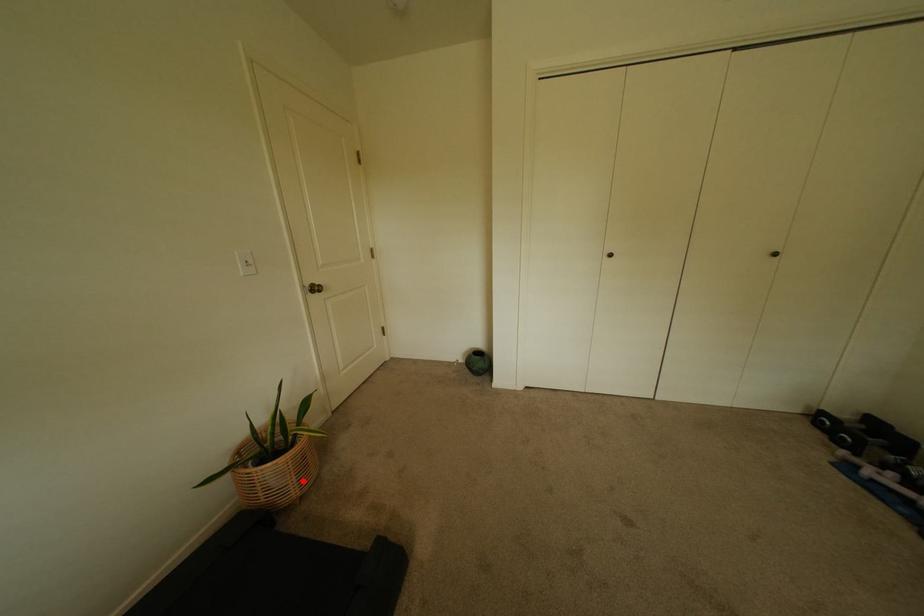
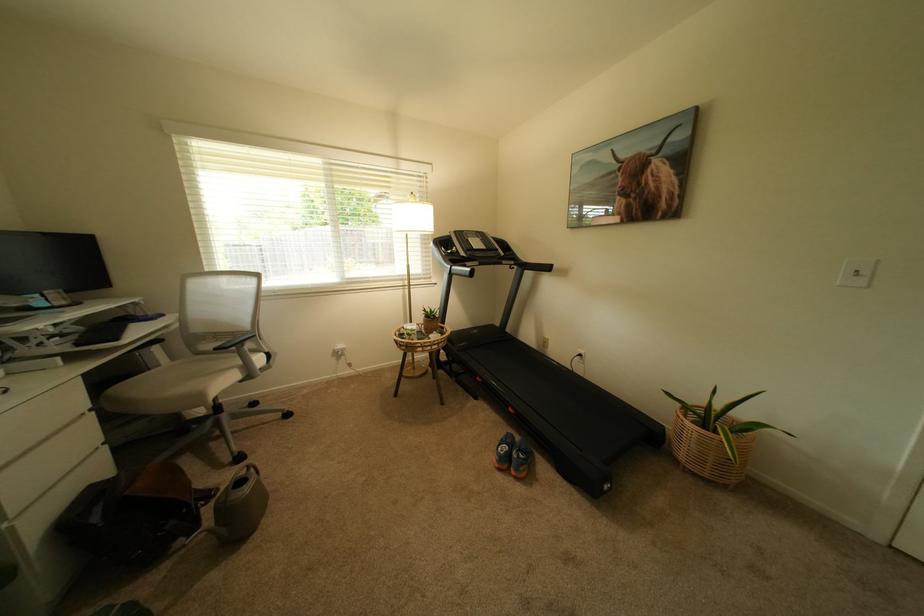
Where in the second image is the point corresponding to the highlighted location from the first image?

(695, 448)